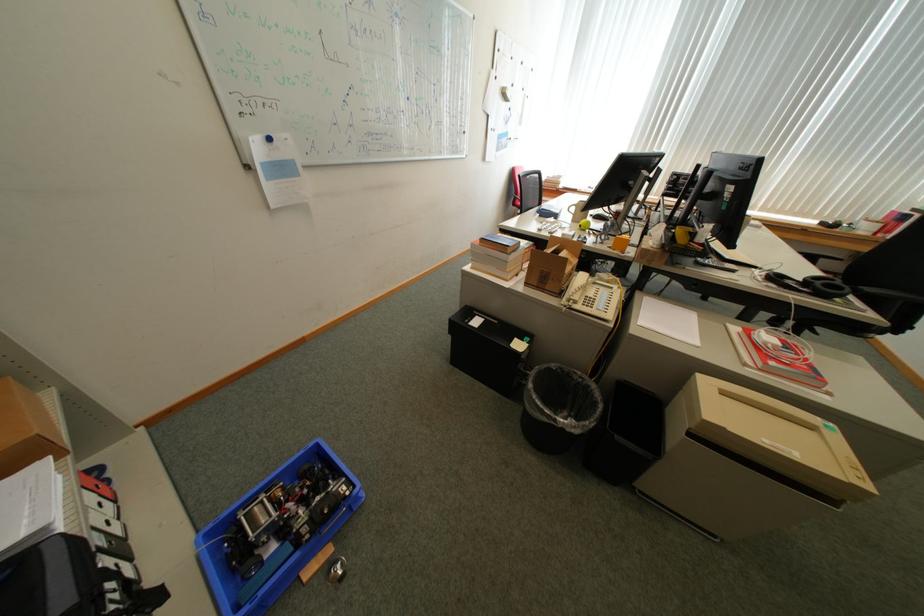
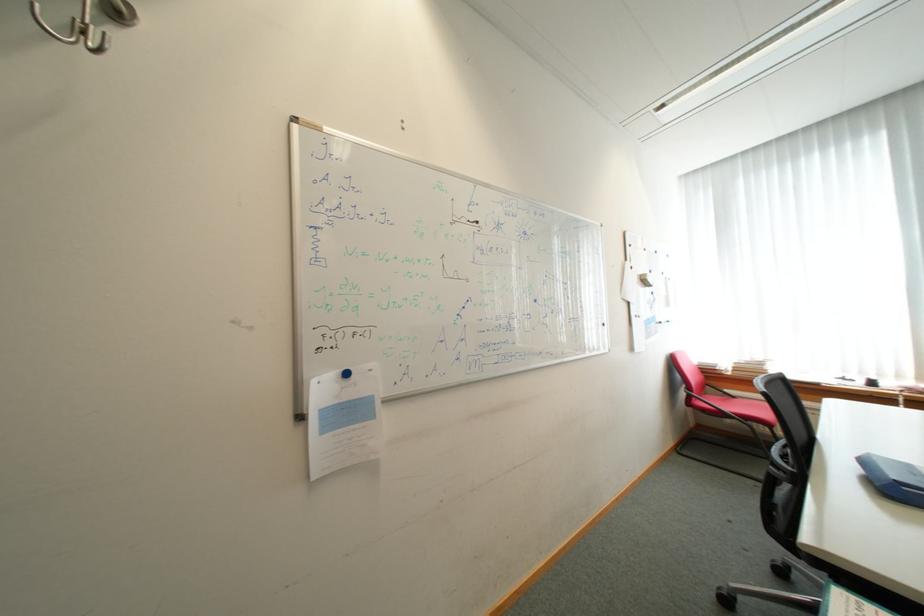
The first image is from the beginning of the video and the second image is from the end. How did the camera likely rotate when shooting the video?

The rotation direction of the camera is left-up.